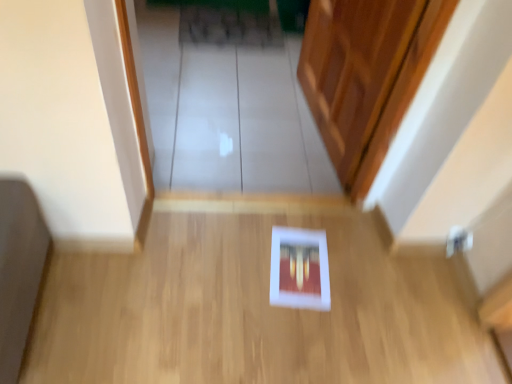
You are a GUI agent. You are given a task and a screenshot of the screen. Output one action in this format:
    pyautogui.click(x=<x>, y=<y>)
    Task: Click on the empty space that is ontop of transparent glass door at center (from a real-world perspective)
    The width and height of the screenshot is (512, 384).
    Given the screenshot: What is the action you would take?
    pyautogui.click(x=243, y=84)